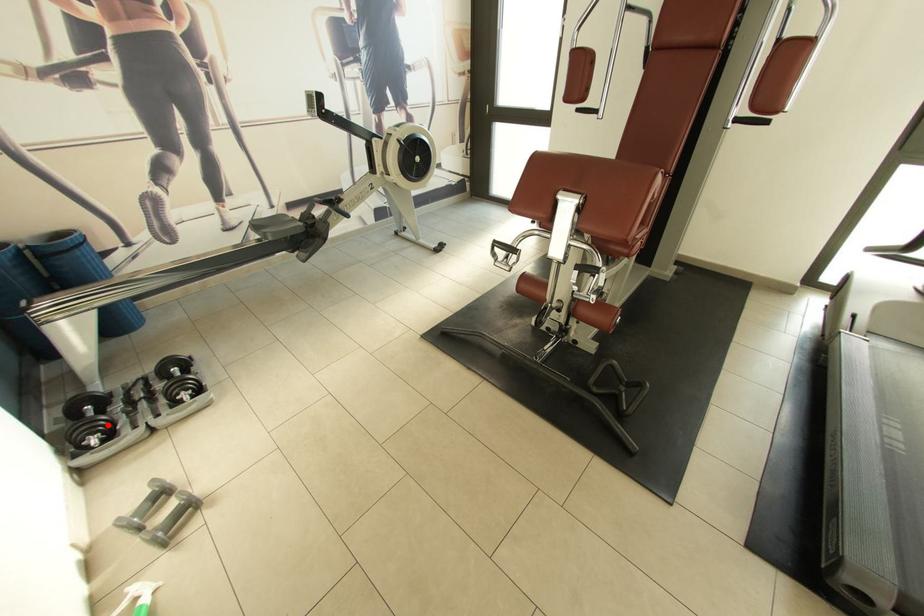
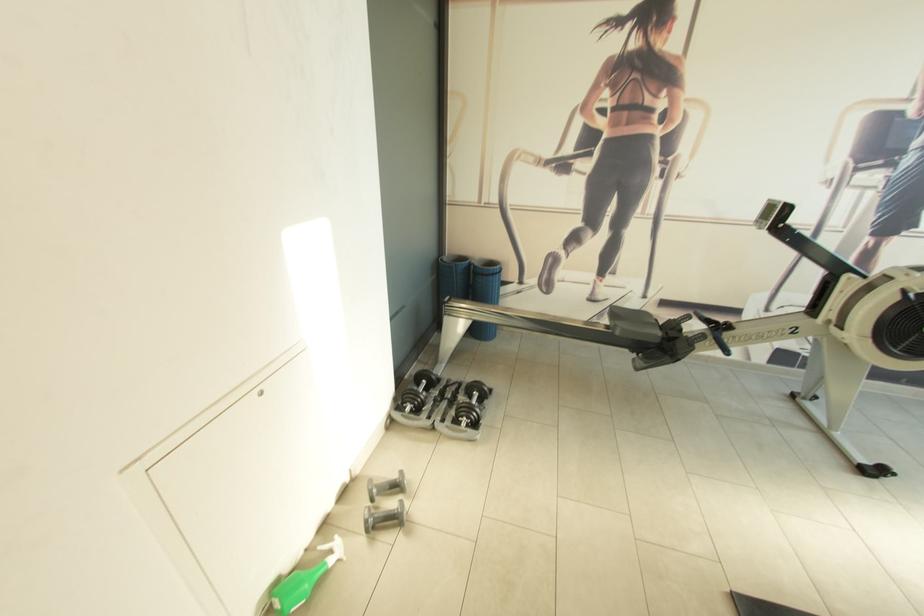
Question: I am providing you with two images of the same scene from different viewpoints. In image1, a red point is highlighted. Considering the same 3D point in image2, which of the following is correct?

Choices:
 (A) It is closer
 (B) It is farther

Answer: (B)